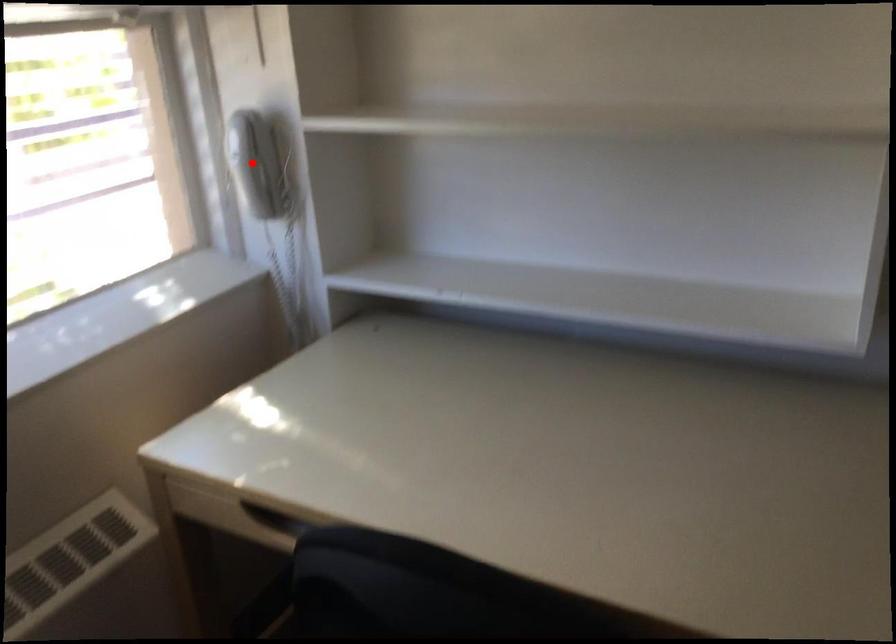
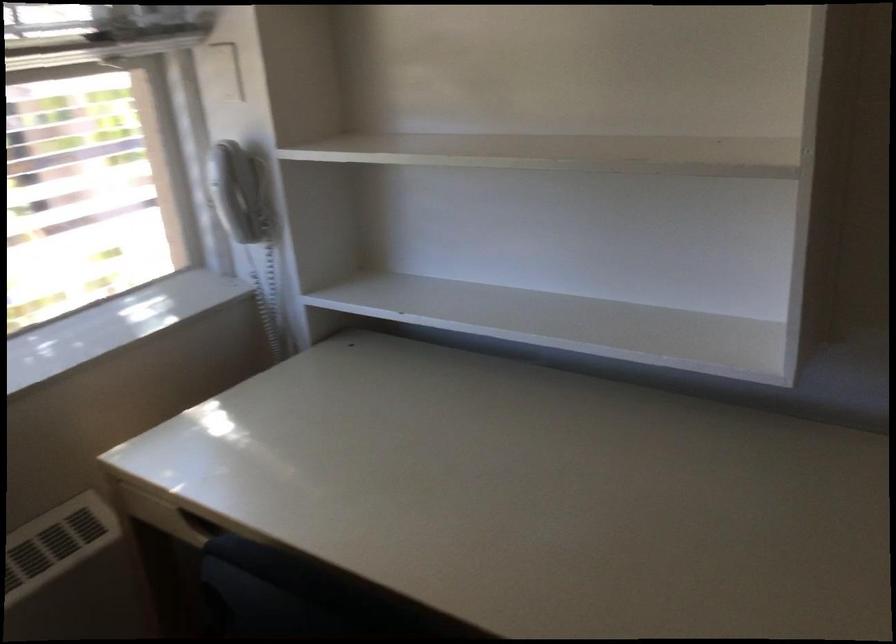
Where in the second image is the point corresponding to the highlighted location from the first image?

(230, 190)